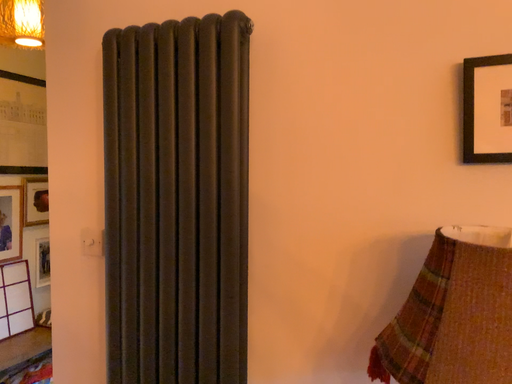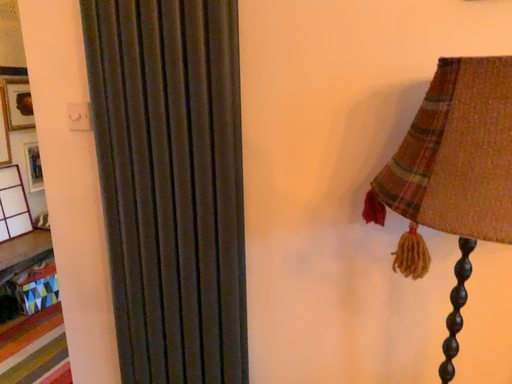
Question: Which way did the camera rotate in the video?

Choices:
 (A) rotated upward
 (B) rotated downward

Answer: (B)